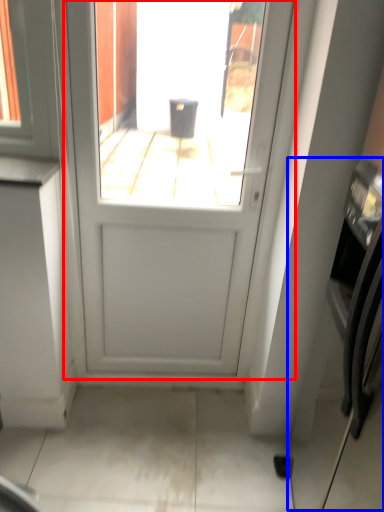
Question: Which of the following is the closest to the observer, door (highlighted by a red box) or oven (highlighted by a blue box)?

Choices:
 (A) door
 (B) oven

Answer: (B)